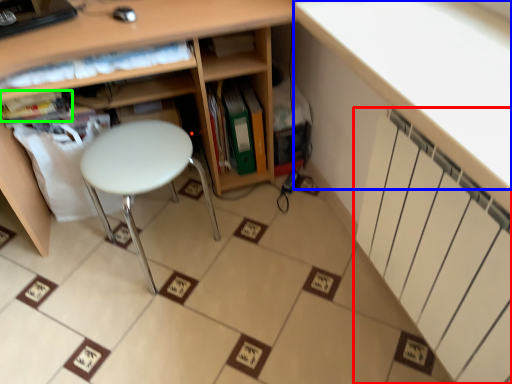
Question: Which object is the closest to the radiator (highlighted by a red box)? Choose among these: counter top (highlighted by a blue box) or book (highlighted by a green box).

Choices:
 (A) counter top
 (B) book

Answer: (A)